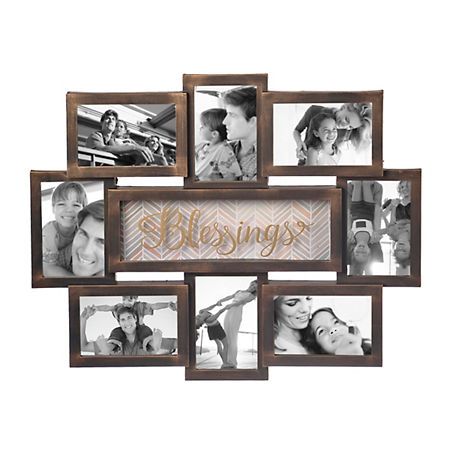
This screenshot has width=450, height=450. Identify the location of black and white family photos. (69, 227), (123, 133), (222, 124), (337, 130), (327, 329), (220, 310), (131, 334).